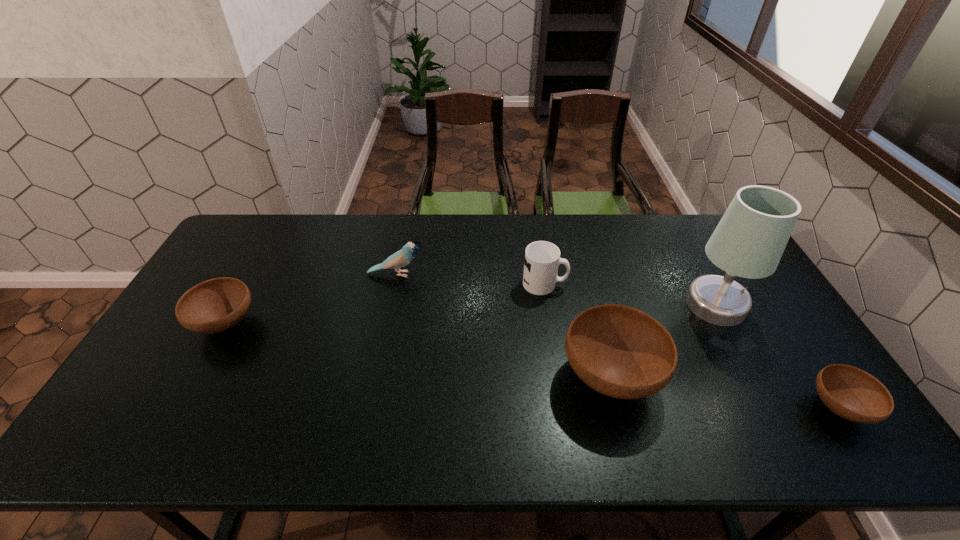
Where is `free point between the mug and the shortest object`? free point between the mug and the shortest object is located at coordinates (691, 346).

Find the location of a particular element. vacant region between the tallest object and the shortest object is located at coordinates (777, 356).

I want to click on vacant region between the fifth tallest object and the tallest bowl, so click(x=418, y=350).

Choose which object is the fifth nearest neighbor to the second shortest object. Please provide its 2D coordinates. Your answer should be formatted as a tuple, i.e. [(x, y)], where the tuple contains the x and y coordinates of a point satisfying the conditions above.

[(851, 393)]

Locate an element on the screen. The width and height of the screenshot is (960, 540). the fourth closest object relative to the second shortest bowl is located at coordinates [749, 241].

Find the location of a particular element. The image size is (960, 540). bowl identified as the second closest to the second bowl from left to right is located at coordinates (215, 305).

Select which bowl is the closest to the second tallest bowl. Please provide its 2D coordinates. Your answer should be formatted as a tuple, i.e. [(x, y)], where the tuple contains the x and y coordinates of a point satisfying the conditions above.

[(619, 351)]

The image size is (960, 540). I want to click on vacant space that satisfies the following two spatial constraints: 1. on the handle side of the shortest object; 2. on the right side of the mug, so click(x=564, y=408).

Locate an element on the screen. This screenshot has height=540, width=960. vacant area in the image that satisfies the following two spatial constraints: 1. on the handle side of the shortest bowl; 2. on the left side of the mug is located at coordinates (564, 408).

At what (x,y) coordinates should I click in order to perform the action: click on free region that satisfies the following two spatial constraints: 1. at the face of the second object from left to right; 2. on the back side of the second bowl from left to right. Please return your answer as a coordinate pair (x, y). Looking at the image, I should click on (375, 376).